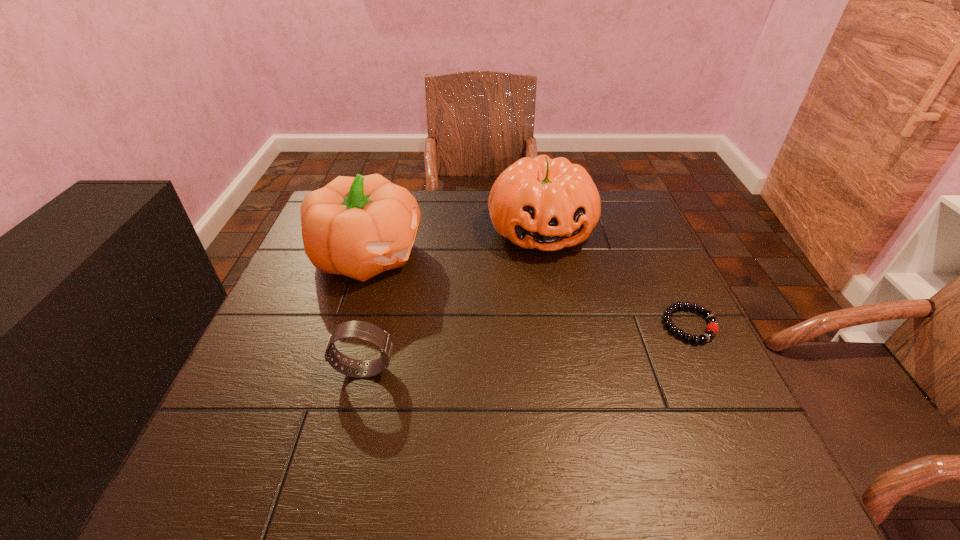
Find the location of `vacant space situated 0.310m on the carved face of the left pumpkin`. vacant space situated 0.310m on the carved face of the left pumpkin is located at coordinates (522, 321).

The width and height of the screenshot is (960, 540). In order to click on vacant point located on the carved face of the right pumpkin in this screenshot , I will do `click(582, 367)`.

At what (x,y) coordinates should I click in order to perform the action: click on free space located on the carved face of the right pumpkin. Please return your answer as a coordinate pair (x, y). This screenshot has height=540, width=960. Looking at the image, I should click on (574, 341).

Where is `vacant space located 0.230m on the carved face of the right pumpkin`? vacant space located 0.230m on the carved face of the right pumpkin is located at coordinates (571, 330).

You are a GUI agent. You are given a task and a screenshot of the screen. Output one action in this format:
    pyautogui.click(x=<x>, y=<y>)
    Task: Click on the object situated at the left edge
    This screenshot has height=540, width=960.
    Given the screenshot: What is the action you would take?
    pyautogui.click(x=358, y=227)

I want to click on bracelet that is at the right edge, so click(712, 328).

Locate an element on the screen. Image resolution: width=960 pixels, height=540 pixels. pumpkin located in the right edge section of the desktop is located at coordinates (548, 204).

Identify the location of object located in the far left corner section of the desktop. This screenshot has height=540, width=960. (358, 227).

At what (x,y) coordinates should I click in order to perform the action: click on object located in the far right corner section of the desktop. Please return your answer as a coordinate pair (x, y). The width and height of the screenshot is (960, 540). Looking at the image, I should click on (x=548, y=204).

Locate an element on the screen. The image size is (960, 540). vacant space at the far edge of the desktop is located at coordinates point(463,192).